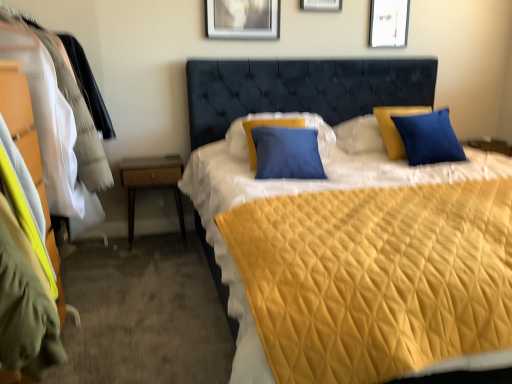
Question: Considering the positions of point (61, 312) and point (374, 3), is point (61, 312) closer or farther from the camera than point (374, 3)?

Choices:
 (A) closer
 (B) farther

Answer: (A)

Question: Is matte wood dresser at left inside or outside of white paper at upper center, which is the 3th picture frame in left-to-right order?

Choices:
 (A) outside
 (B) inside

Answer: (A)

Question: Which object is positioned farthest from the matte silver picture frame at upper center, which ranks as the 2th picture frame in right-to-left order?

Choices:
 (A) blue matte pillow at center
 (B) white paper at upper center, positioned as the 1th picture frame in right-to-left order
 (C) matte wood dresser at left
 (D) metallic silver picture frame at upper center, positioned as the first picture frame in left-to-right order
 (E) wooden nightstand at lower left

Answer: (C)

Question: Which object is the closest to the white paper at upper center, positioned as the 1th picture frame in right-to-left order?

Choices:
 (A) matte wood dresser at left
 (B) metallic silver picture frame at upper center, positioned as the first picture frame in left-to-right order
 (C) matte silver picture frame at upper center, arranged as the 2th picture frame when viewed from the left
 (D) wooden nightstand at lower left
 (E) blue matte pillow at center

Answer: (C)